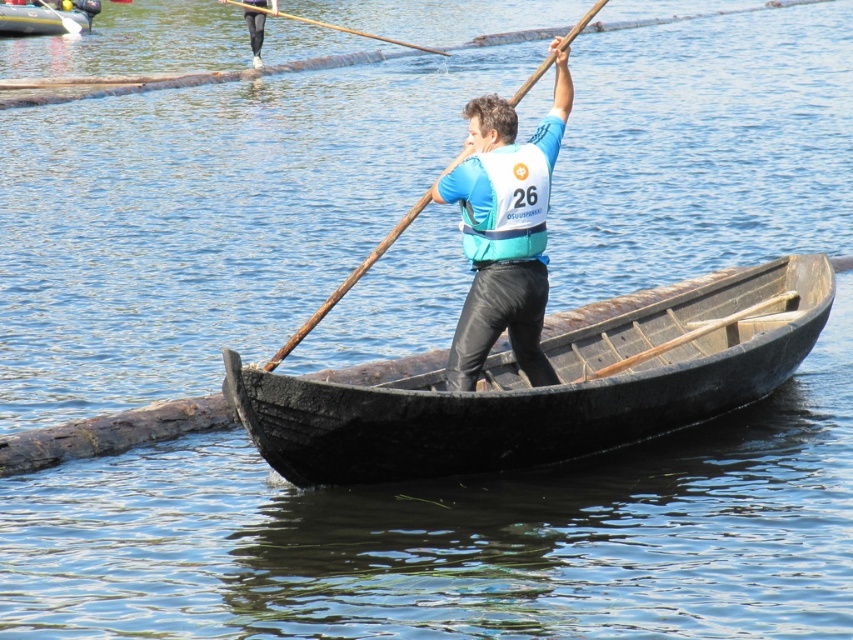
You are a photographer trying to capture the black leggings at upper center in focus while also including the rubberized inflatable boat at upper left in the background. Given their positions, will the boat appear closer to the camera than the leggings in the photo?

The rubberized inflatable boat at upper left is further to the viewer than black leggings at upper center, so the boat will appear closer to the camera than the leggings in the photo.

You are standing on a dock and see the wooden textured paddle at center in the boat. If your eyes are at the same height as the paddle, can you reach it with a 25 meter long pole?

The wooden textured paddle at center is 25.19 meters away from viewer. Since the pole is only 25 meters long, it is 0.19 meters shorter than needed. Therefore, you cannot reach the paddle with the pole.

You are a photographer trying to capture the scene of the rower. You want to ensure that both the wooden at center and the black leggings at upper center are clearly visible in your photo. Based on their positions, which object should you focus on first to ensure both are in frame?

The wooden at center is positioned on the right side of black leggings at upper center. To ensure both are in frame, focus on the black leggings at upper center first, as it is on the left side, allowing the wooden at center to be captured to its right within the same shot.